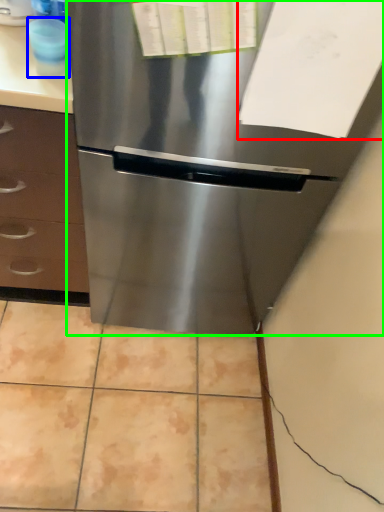
Question: Which is nearer to the paper (highlighted by a red box)? appliance (highlighted by a blue box) or refrigerator (highlighted by a green box).

Choices:
 (A) appliance
 (B) refrigerator

Answer: (B)